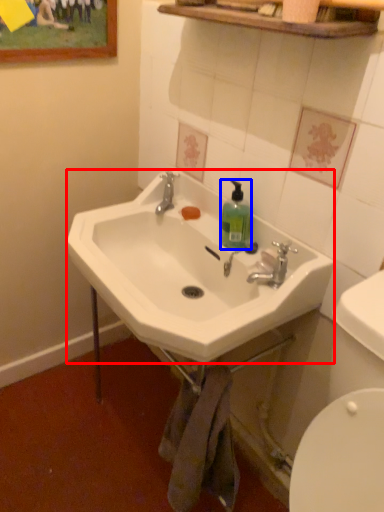
Question: Which point is closer to the camera, sink (highlighted by a red box) or bottle (highlighted by a blue box)?

Choices:
 (A) sink
 (B) bottle

Answer: (A)